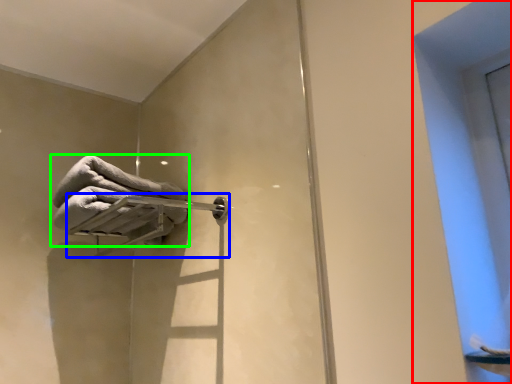
Question: Which is nearer to the window (highlighted by a red box)? towel bar (highlighted by a blue box) or towel (highlighted by a green box).

Choices:
 (A) towel bar
 (B) towel

Answer: (A)